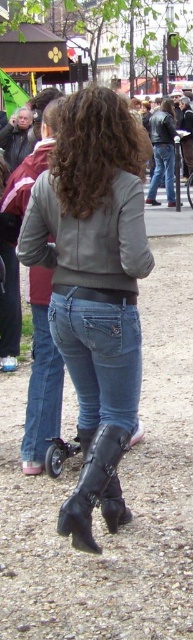
Who is lower down, leather jacket at center or jeans at center?

Positioned lower is jeans at center.

Between leather jacket at center and jeans at center, which one has less height?

With less height is jeans at center.

In order to click on leather jacket at center in this screenshot , I will do `click(94, 285)`.

Is jeans at center positioned at the back of blue denim jeans at center?

No, jeans at center is in front of blue denim jeans at center.

Does jeans at center have a lesser height compared to blue denim jeans at center?

Yes.

The image size is (193, 640). Find the location of `jeans at center`. jeans at center is located at coordinates (99, 356).

Between point (55, 376) and point (93, 442), which one is positioned behind?

Point (55, 376)

Can you confirm if denim at center is wider than black leather boot at lower center?

No, denim at center is not wider than black leather boot at lower center.

Who is more forward, (39,403) or (80,544)?

Point (80,544) is in front.

Locate an element on the screen. denim at center is located at coordinates click(42, 390).